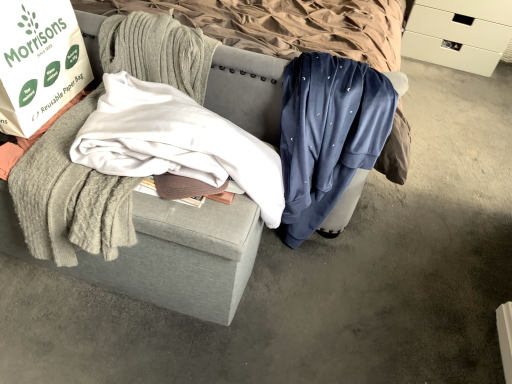
Question: From the image's perspective, is white matte drawer at upper right on top of white paper bag at left?

Choices:
 (A) yes
 (B) no

Answer: (A)

Question: From a real-world perspective, is white matte drawer at upper right below white paper bag at left?

Choices:
 (A) yes
 (B) no

Answer: (A)

Question: From the image's perspective, would you say white matte drawer at upper right is shown under white paper bag at left?

Choices:
 (A) yes
 (B) no

Answer: (B)

Question: Is white matte drawer at upper right shorter than white paper bag at left?

Choices:
 (A) yes
 (B) no

Answer: (B)

Question: Is white matte drawer at upper right not near white paper bag at left?

Choices:
 (A) no
 (B) yes

Answer: (B)

Question: Based on their positions, is textured gray ottoman at center located to the left or right of white matte drawer at upper right?

Choices:
 (A) left
 (B) right

Answer: (A)

Question: From the image's perspective, is textured gray ottoman at center located above or below white matte drawer at upper right?

Choices:
 (A) below
 (B) above

Answer: (A)

Question: In terms of height, does textured gray ottoman at center look taller or shorter compared to white matte drawer at upper right?

Choices:
 (A) tall
 (B) short

Answer: (B)

Question: Looking at the image, does textured gray ottoman at center seem bigger or smaller compared to white matte drawer at upper right?

Choices:
 (A) small
 (B) big

Answer: (B)

Question: From the image's perspective, relative to velvet blue sweatpants at center, acting as the 1th clothing starting from the right, is textured gray ottoman at center above or below?

Choices:
 (A) above
 (B) below

Answer: (A)

Question: Would you say textured gray ottoman at center is to the left or to the right of velvet blue sweatpants at center, which is counted as the second clothing, starting from the left, in the picture?

Choices:
 (A) right
 (B) left

Answer: (A)

Question: Is textured gray ottoman at center wider or thinner than velvet blue sweatpants at center, which is counted as the second clothing, starting from the left?

Choices:
 (A) thin
 (B) wide

Answer: (B)

Question: In the image, is textured gray ottoman at center positioned in front of or behind velvet blue sweatpants at center, acting as the 1th clothing starting from the right?

Choices:
 (A) behind
 (B) front

Answer: (B)

Question: Do you think white paper bag at left is within textured gray ottoman at center, or outside of it?

Choices:
 (A) outside
 (B) inside

Answer: (A)

Question: From a real-world perspective, relative to textured gray ottoman at center, is white paper bag at left vertically above or below?

Choices:
 (A) below
 (B) above

Answer: (B)